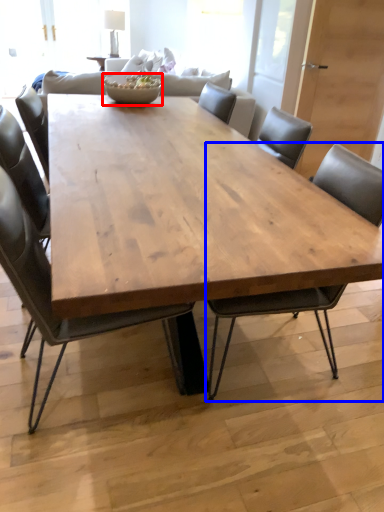
Question: Which object is closer to the camera taking this photo, bowl (highlighted by a red box) or chair (highlighted by a blue box)?

Choices:
 (A) bowl
 (B) chair

Answer: (B)